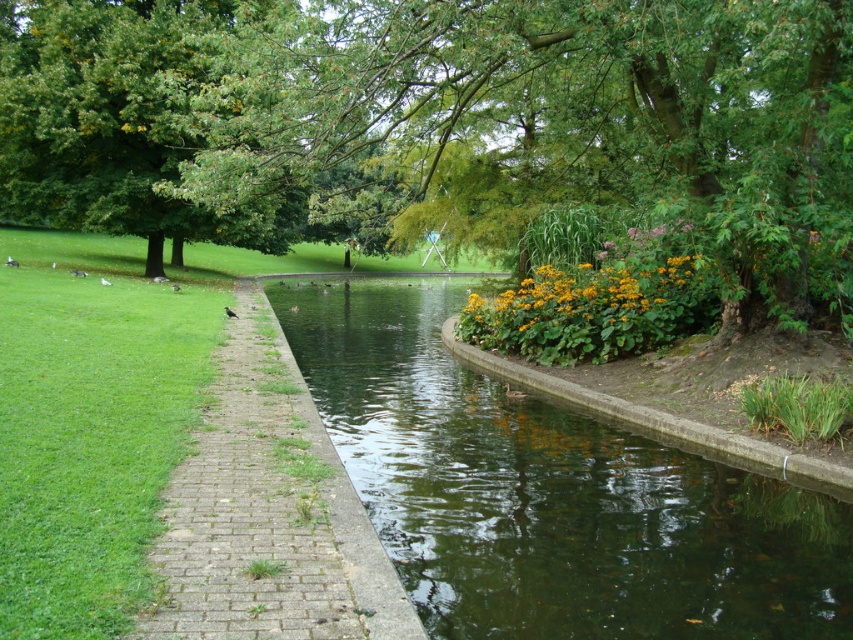
Question: Is green leafy tree at upper left smaller than greenish water at center?

Choices:
 (A) no
 (B) yes

Answer: (A)

Question: Can you confirm if green leafy tree at upper left is smaller than yellow matte flowers at center?

Choices:
 (A) yes
 (B) no

Answer: (B)

Question: Is greenish water at center positioned before brick at center?

Choices:
 (A) no
 (B) yes

Answer: (A)

Question: Which object is closer to the camera taking this photo?

Choices:
 (A) yellow matte flowers at center
 (B) brick at center

Answer: (B)

Question: Based on their relative distances, which object is nearer to the yellow matte flowers at center?

Choices:
 (A) brick at center
 (B) green leafy tree at upper left
 (C) greenish water at center

Answer: (C)

Question: Among these points, which one is nearest to the camera?

Choices:
 (A) (654, 92)
 (B) (422, 488)
 (C) (271, 426)
 (D) (467, 305)

Answer: (B)